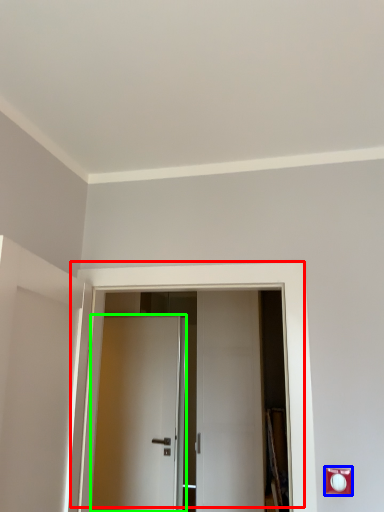
Question: Which object is the farthest from door (highlighted by a red box)? Choose among these: electric outlet (highlighted by a blue box) or door (highlighted by a green box).

Choices:
 (A) electric outlet
 (B) door

Answer: (B)